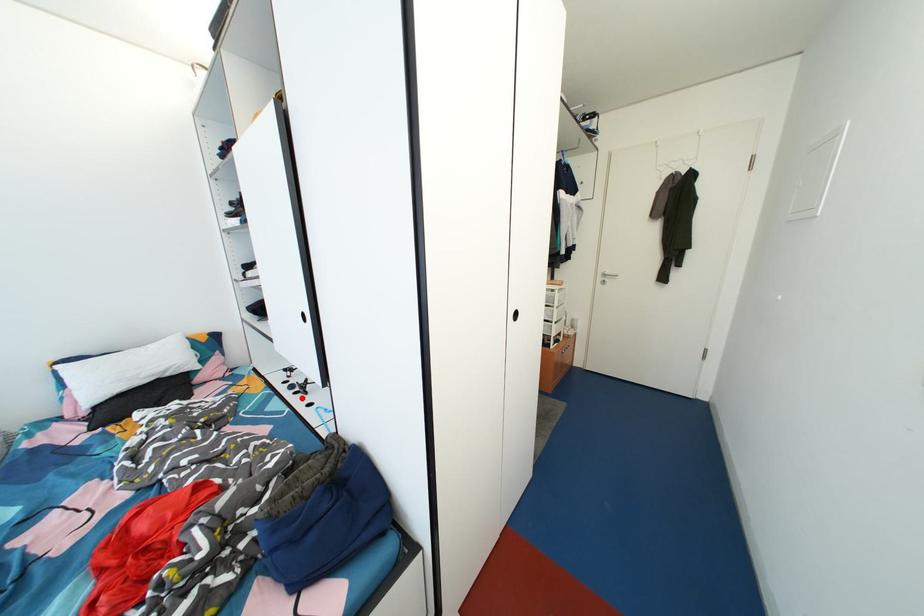
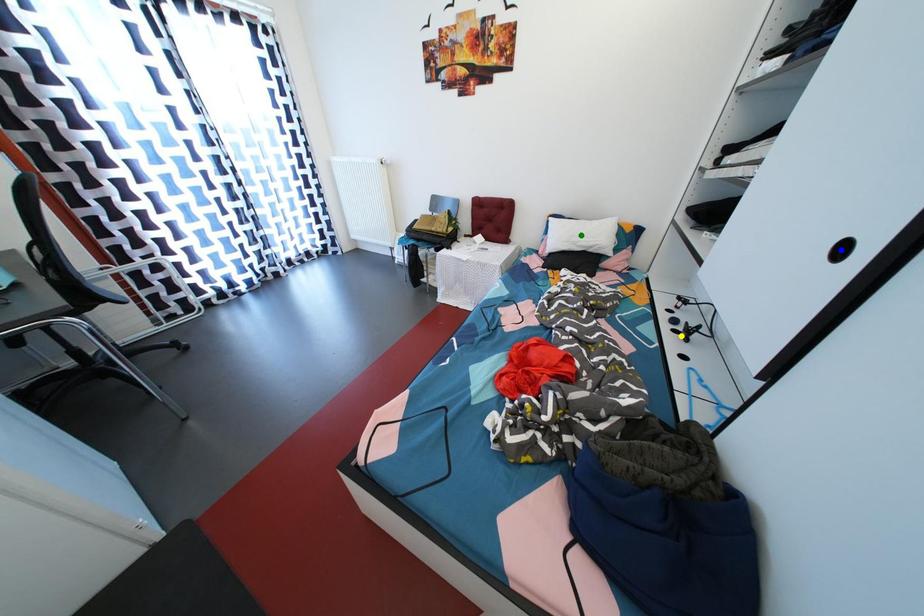
Question: I am providing you with two images of the same scene from different viewpoints. A red point is marked on the first image. You are given multiple points on the second image. Which point in image 2 is actually the same real-world point as the red point in image 1?

Choices:
 (A) blue point
 (B) yellow point
 (C) green point

Answer: (B)